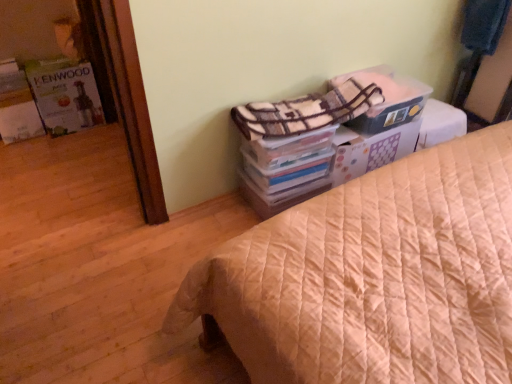
Question: Does plaid fabric blanket at upper right, which is counted as the second blanket, starting from the back, have a lesser height compared to white cardboard box at upper right?

Choices:
 (A) no
 (B) yes

Answer: (B)

Question: Can you confirm if plaid fabric blanket at upper right, marked as the 1th blanket in a left-to-right arrangement, is thinner than white cardboard box at upper right?

Choices:
 (A) yes
 (B) no

Answer: (A)

Question: Is plaid fabric blanket at upper right, which ranks as the 2th blanket in top-to-bottom order, further to the viewer compared to white cardboard box at upper right?

Choices:
 (A) no
 (B) yes

Answer: (A)

Question: From the image's perspective, is plaid fabric blanket at upper right, which is the first blanket from bottom to top, below white cardboard box at upper right?

Choices:
 (A) no
 (B) yes

Answer: (B)

Question: From a real-world perspective, is plaid fabric blanket at upper right, which appears as the first blanket when viewed from the front, located higher than white cardboard box at upper right?

Choices:
 (A) no
 (B) yes

Answer: (B)

Question: From a real-world perspective, is white cardboard box at upper right positioned above or below beige quilted bed at center?

Choices:
 (A) below
 (B) above

Answer: (A)

Question: Is white cardboard box at upper right wider or thinner than beige quilted bed at center?

Choices:
 (A) thin
 (B) wide

Answer: (A)

Question: From their relative heights in the image, would you say white cardboard box at upper right is taller or shorter than beige quilted bed at center?

Choices:
 (A) short
 (B) tall

Answer: (A)

Question: In the image, is white cardboard box at upper right positioned in front of or behind beige quilted bed at center?

Choices:
 (A) front
 (B) behind

Answer: (B)

Question: Considering the positions of matte white kenwood appliance at left and beige quilted bed at center in the image, is matte white kenwood appliance at left taller or shorter than beige quilted bed at center?

Choices:
 (A) tall
 (B) short

Answer: (B)

Question: In the image, is matte white kenwood appliance at left positioned in front of or behind beige quilted bed at center?

Choices:
 (A) front
 (B) behind

Answer: (B)

Question: Is matte white kenwood appliance at left wider or thinner than beige quilted bed at center?

Choices:
 (A) thin
 (B) wide

Answer: (A)

Question: Is point (73, 81) closer or farther from the camera than point (267, 244)?

Choices:
 (A) farther
 (B) closer

Answer: (A)

Question: From a real-world perspective, is white cardboard box at upper right physically located above or below plaid fabric blanket at upper right, positioned as the 1th blanket in top-to-bottom order?

Choices:
 (A) above
 (B) below

Answer: (B)

Question: Is white cardboard box at upper right taller or shorter than plaid fabric blanket at upper right, acting as the first blanket starting from the back?

Choices:
 (A) tall
 (B) short

Answer: (B)